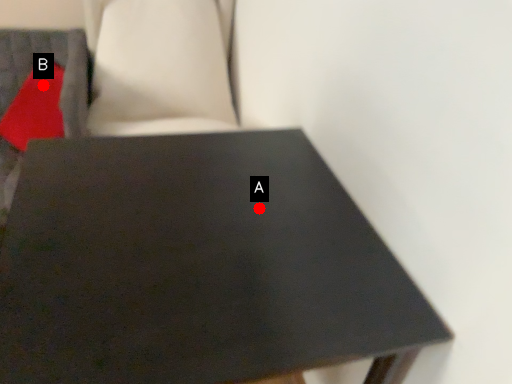
Question: Two points are circled on the image, labeled by A and B beside each circle. Which point is further to the camera?

Choices:
 (A) A is further
 (B) B is further

Answer: (B)